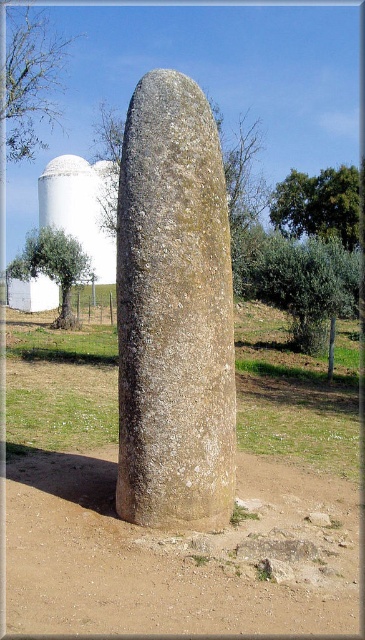
Based on the photo, you are an archaeologist examining the image of the ancient stone monolith. You notice a specific point marked at coordinates (174,312). Based on the image, what does this point likely represent?

The point at coordinates (174,312) likely represents the location of the speckled stone monolith at center, as it is the central feature in the image and the coordinates align with its position.